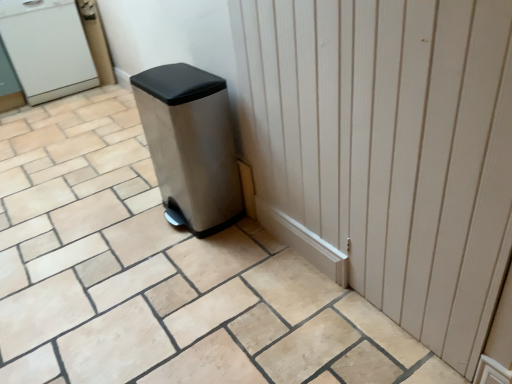
The height and width of the screenshot is (384, 512). Find the location of `vacant area that lies between stainless steel trash can at center and white wood door at center`. vacant area that lies between stainless steel trash can at center and white wood door at center is located at coordinates (289, 280).